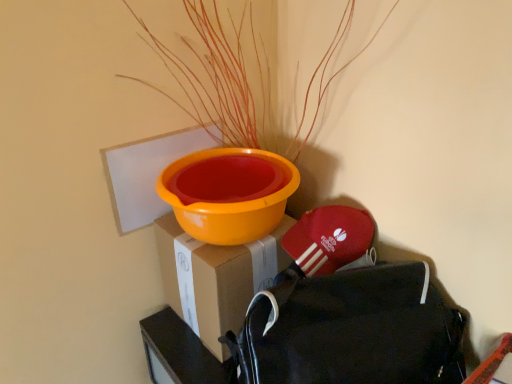
Question: Looking at the image, does orange matte plant at upper center seem bigger or smaller compared to black fabric backpack at lower right?

Choices:
 (A) big
 (B) small

Answer: (A)

Question: Based on their positions, is orange matte plant at upper center located to the left or right of black fabric backpack at lower right?

Choices:
 (A) left
 (B) right

Answer: (A)

Question: Estimate the real-world distances between objects in this image. Which object is farther from the cardboard box at center?

Choices:
 (A) black fabric backpack at lower right
 (B) orange matte plant at upper center

Answer: (B)

Question: Considering the real-world distances, which object is farthest from the orange matte plant at upper center?

Choices:
 (A) black fabric backpack at lower right
 (B) cardboard box at center

Answer: (A)